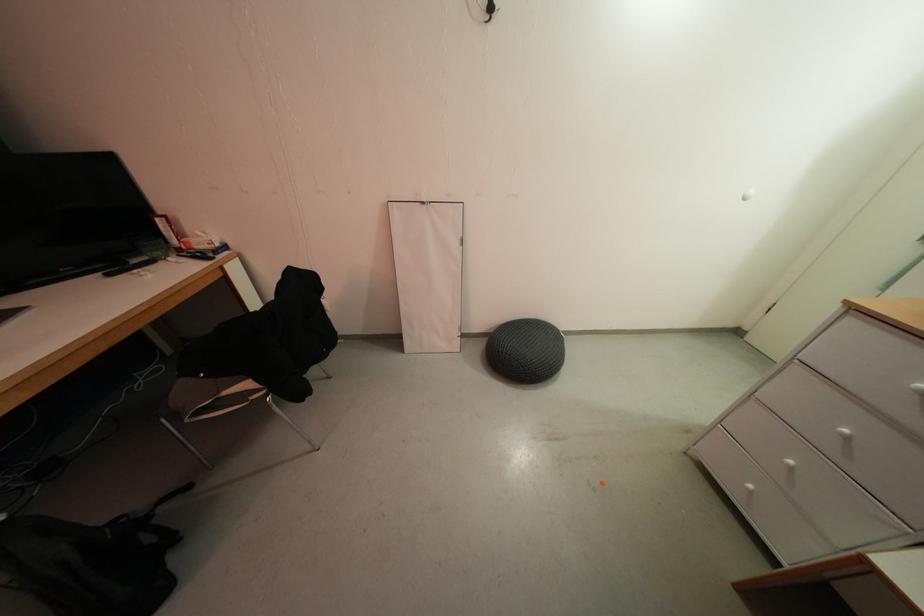
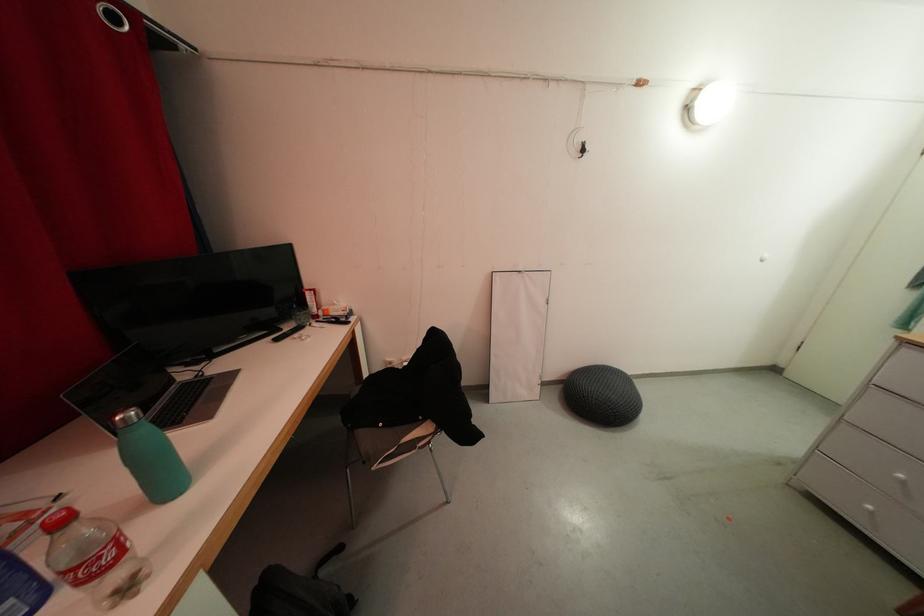
In the second image, find the point that corresponds to (181,537) in the first image.

(357, 601)